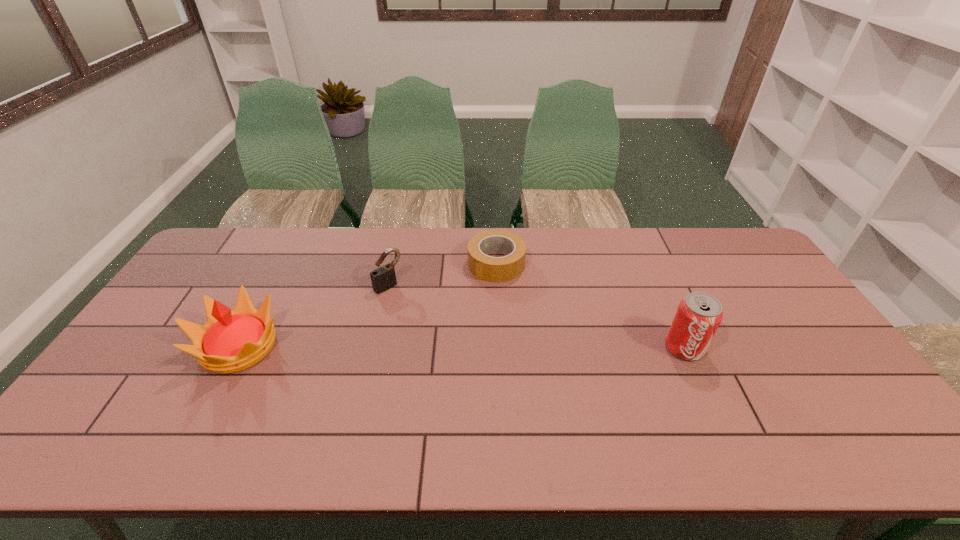
Where is `free spot on the desktop that is between the leftmost object and the soda can and is positioned with the keyhole on the front of the second shortest object`? free spot on the desktop that is between the leftmost object and the soda can and is positioned with the keyhole on the front of the second shortest object is located at coordinates (454, 347).

You are a GUI agent. You are given a task and a screenshot of the screen. Output one action in this format:
    pyautogui.click(x=<x>, y=<y>)
    Task: Click on the vacant space on the desktop that is between the leftmost object and the soda can and is positioned at the edge of the duct tape
    Image resolution: width=960 pixels, height=540 pixels.
    Given the screenshot: What is the action you would take?
    pyautogui.click(x=406, y=347)